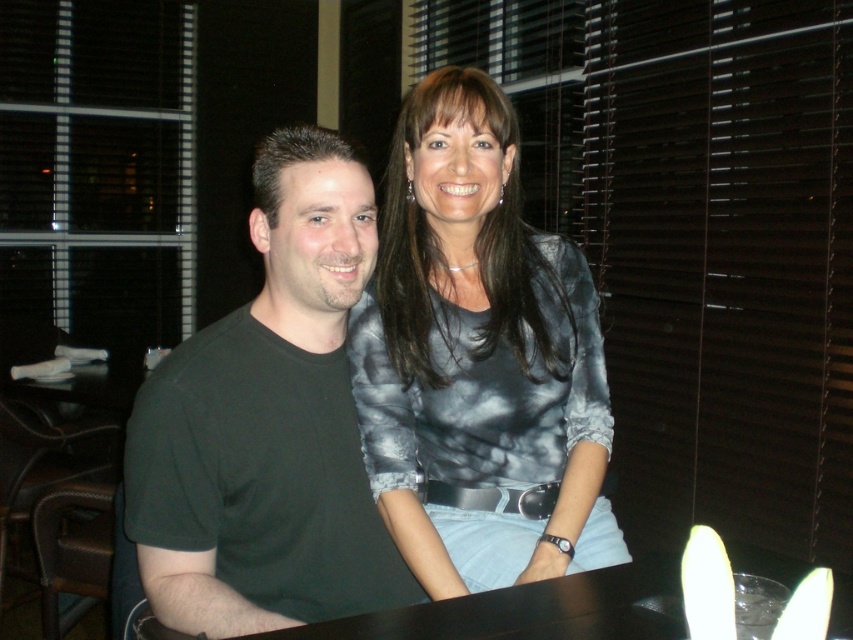
Question: Does metallic gray shirt at upper center appear under matte gray blouse at center?

Choices:
 (A) no
 (B) yes

Answer: (A)

Question: Can you confirm if matte gray blouse at center is positioned above black matte t-shirt at center?

Choices:
 (A) no
 (B) yes

Answer: (B)

Question: Which is nearer to the black matte t-shirt at center?

Choices:
 (A) metallic gray shirt at upper center
 (B) matte gray blouse at center

Answer: (B)

Question: Based on their relative distances, which object is nearer to the metallic gray shirt at upper center?

Choices:
 (A) black matte t-shirt at center
 (B) matte gray blouse at center

Answer: (B)

Question: Which point is farther from the camera taking this photo?

Choices:
 (A) (412, 570)
 (B) (846, 179)
 (C) (143, 477)

Answer: (B)

Question: Is matte gray blouse at center below black matte t-shirt at center?

Choices:
 (A) yes
 (B) no

Answer: (B)